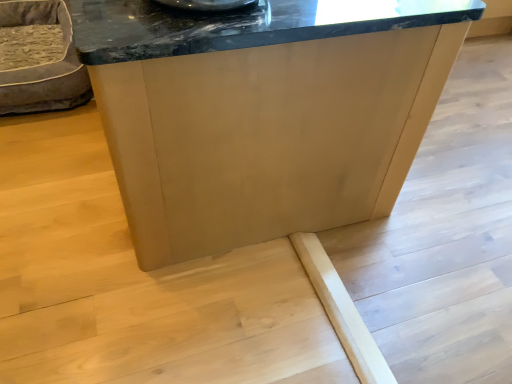
Locate an element on the screen. The image size is (512, 384). matte wood table at center is located at coordinates (262, 113).

The image size is (512, 384). What do you see at coordinates (262, 113) in the screenshot? I see `matte wood table at center` at bounding box center [262, 113].

This screenshot has width=512, height=384. What do you see at coordinates (42, 64) in the screenshot?
I see `velvet grey pet bed at left` at bounding box center [42, 64].

The image size is (512, 384). Find the location of `velvet grey pet bed at left`. velvet grey pet bed at left is located at coordinates (42, 64).

Locate an element on the screen. matte wood table at center is located at coordinates (262, 113).

Considering the relative positions of matte wood table at center and velvet grey pet bed at left in the image provided, is matte wood table at center to the left or to the right of velvet grey pet bed at left?

From the image, it's evident that matte wood table at center is to the right of velvet grey pet bed at left.

Which object is further away from the camera taking this photo, matte wood table at center or velvet grey pet bed at left?

velvet grey pet bed at left.

Does point (263, 219) appear closer or farther from the camera than point (39, 79)?

Point (263, 219) is positioned closer to the camera compared to point (39, 79).

From the image's perspective, is matte wood table at center on velvet grey pet bed at left?

Actually, matte wood table at center appears below velvet grey pet bed at left in the image.

In the scene shown: From a real-world perspective, is matte wood table at center below velvet grey pet bed at left?

No.

Which object is thinner, matte wood table at center or velvet grey pet bed at left?

velvet grey pet bed at left is thinner.

Can you confirm if matte wood table at center is taller than velvet grey pet bed at left?

Indeed, matte wood table at center has a greater height compared to velvet grey pet bed at left.

Between matte wood table at center and velvet grey pet bed at left, which one has larger size?

Bigger between the two is matte wood table at center.

Can velvet grey pet bed at left be found inside matte wood table at center?

No, matte wood table at center does not contain velvet grey pet bed at left.

Based on the photo, does matte wood table at center touch velvet grey pet bed at left?

No, matte wood table at center is not with velvet grey pet bed at left.

Is matte wood table at center turned away from velvet grey pet bed at left?

No, velvet grey pet bed at left is not at the back of matte wood table at center.

What's the angular difference between matte wood table at center and velvet grey pet bed at left's facing directions?

There is a 0.204-degree angle between the facing directions of matte wood table at center and velvet grey pet bed at left.

Image resolution: width=512 pixels, height=384 pixels. I want to click on table in front of the velvet grey pet bed at left, so [x=262, y=113].

Considering the relative positions of velvet grey pet bed at left and matte wood table at center in the image provided, is velvet grey pet bed at left to the left of matte wood table at center from the viewer's perspective?

Yes.

In the scene shown: Relative to matte wood table at center, is velvet grey pet bed at left in front or behind?

velvet grey pet bed at left is positioned farther from the viewer than matte wood table at center.

Between point (58, 84) and point (258, 149), which one is positioned in front?

Positioned in front is point (258, 149).

From the image's perspective, between velvet grey pet bed at left and matte wood table at center, who is located below?

matte wood table at center.

From a real-world perspective, which object stands above the other?

matte wood table at center, from a real-world perspective.

Between velvet grey pet bed at left and matte wood table at center, which one has smaller width?

Thinner between the two is velvet grey pet bed at left.

Considering the relative sizes of velvet grey pet bed at left and matte wood table at center in the image provided, is velvet grey pet bed at left taller than matte wood table at center?

No.

Between velvet grey pet bed at left and matte wood table at center, which one has smaller size?

Smaller between the two is velvet grey pet bed at left.

Is velvet grey pet bed at left spatially inside matte wood table at center, or outside of it?

velvet grey pet bed at left exists outside the volume of matte wood table at center.

Is velvet grey pet bed at left directly adjacent to matte wood table at center?

They are not placed beside each other.

Is velvet grey pet bed at left looking in the opposite direction of matte wood table at center?

No, velvet grey pet bed at left's orientation is not away from matte wood table at center.

Find the location of a particular element. The width and height of the screenshot is (512, 384). table in front of the velvet grey pet bed at left is located at coordinates (262, 113).

Image resolution: width=512 pixels, height=384 pixels. Find the location of `furniture that is under the matte wood table at center (from a real-world perspective)`. furniture that is under the matte wood table at center (from a real-world perspective) is located at coordinates (42, 64).

Identify the location of furniture behind the matte wood table at center. (42, 64).